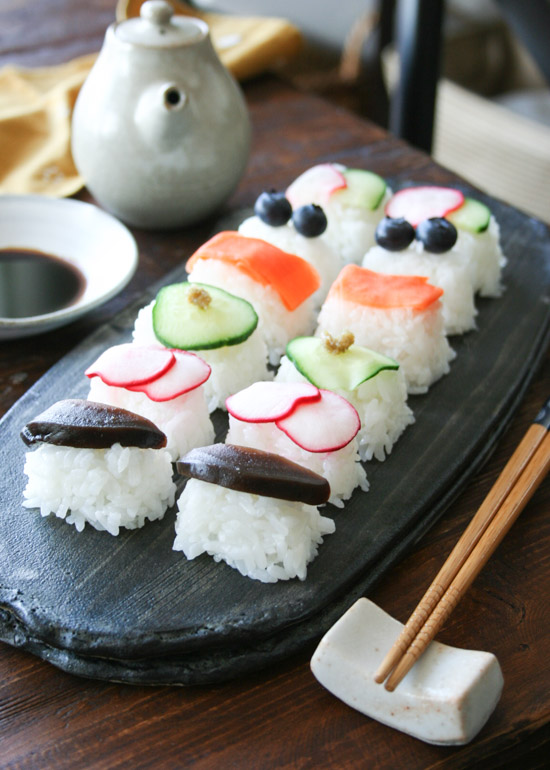
You are a GUI agent. You are given a task and a screenshot of the screen. Output one action in this format:
    pyautogui.click(x=<x>, y=<y>)
    Task: Click on the chopsticks
    Image resolution: width=550 pixels, height=770 pixels.
    Given the screenshot: What is the action you would take?
    pyautogui.click(x=440, y=603), pyautogui.click(x=437, y=590)